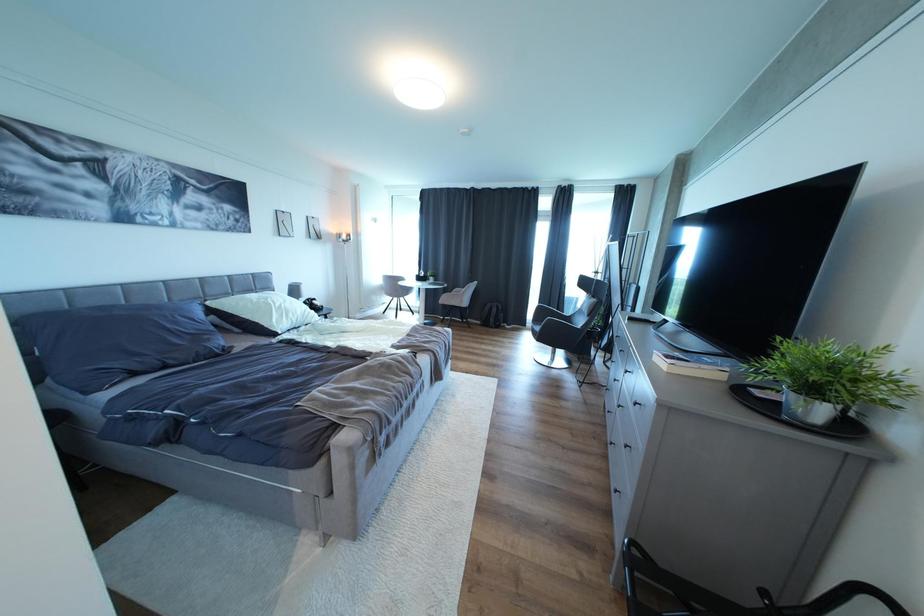
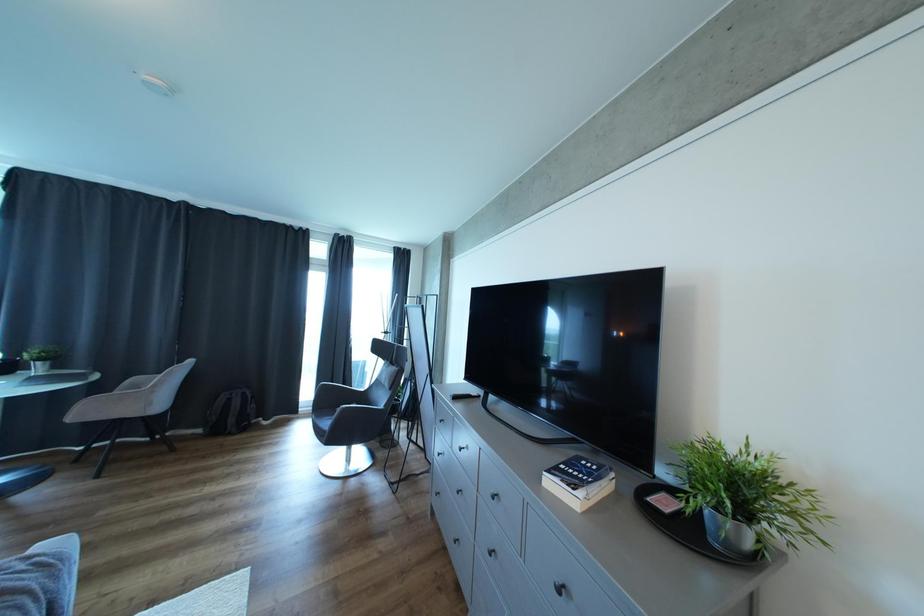
Question: The camera is either moving clockwise (left) or counter-clockwise (right) around the object. The first image is from the beginning of the video and the second image is from the end. Is the camera moving left or right when shooting the video?

Choices:
 (A) Left
 (B) Right

Answer: (A)